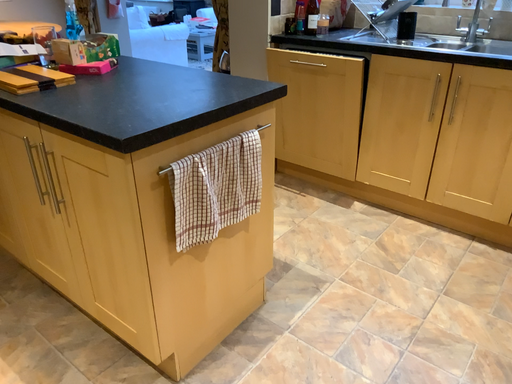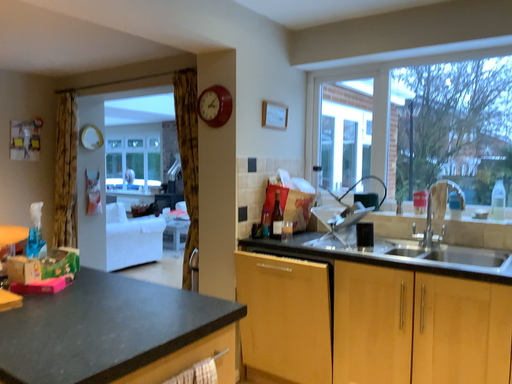
Question: Which way did the camera rotate in the video?

Choices:
 (A) rotated upward
 (B) rotated downward

Answer: (A)